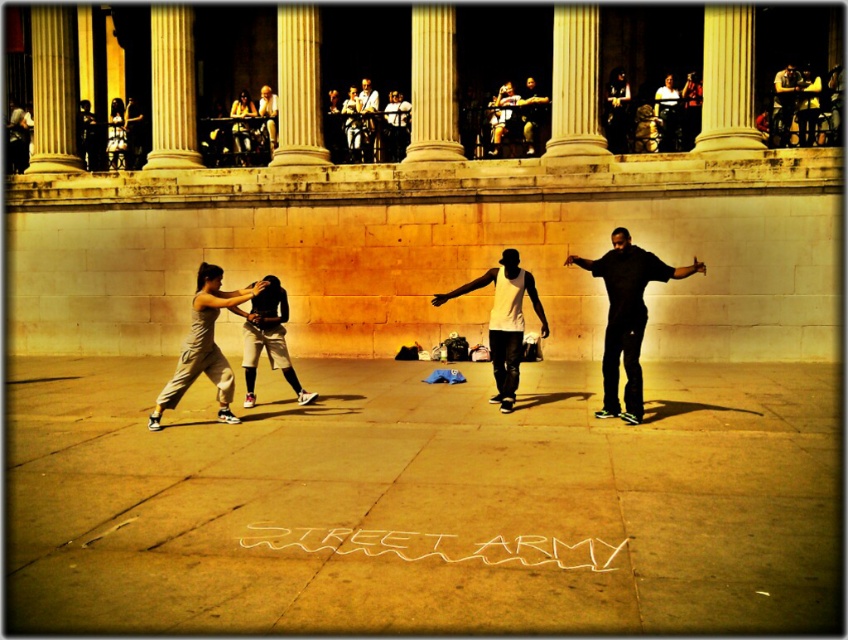
Does dark blue jeans at center have a greater width compared to matte black tank top at center?

In fact, dark blue jeans at center might be narrower than matte black tank top at center.

Does point (793, 83) lie behind point (526, 84)?

No.

The image size is (848, 640). I want to click on dark blue jeans at center, so click(x=784, y=102).

Between point (219, 300) and point (522, 349), which one is positioned in front?

Positioned in front is point (219, 300).

Is gray fabric pants at lower left taller than white matte tank top at center?

No, gray fabric pants at lower left is not taller than white matte tank top at center.

Does point (196, 372) come closer to viewer compared to point (499, 385)?

Yes, point (196, 372) is in front of point (499, 385).

This screenshot has width=848, height=640. Identify the location of gray fabric pants at lower left. (204, 346).

Is matte black tank top at center closer to camera compared to light brown leather jacket at center?

Yes, it is in front of light brown leather jacket at center.

Does matte black tank top at center have a larger size compared to light brown leather jacket at center?

Yes, matte black tank top at center is bigger than light brown leather jacket at center.

Between point (539, 99) and point (372, 108), which one is positioned in front?

Point (539, 99) is in front.

At what (x,y) coordinates should I click in order to perform the action: click on matte black tank top at center. Please return your answer as a coordinate pair (x, y). Looking at the image, I should click on (531, 113).